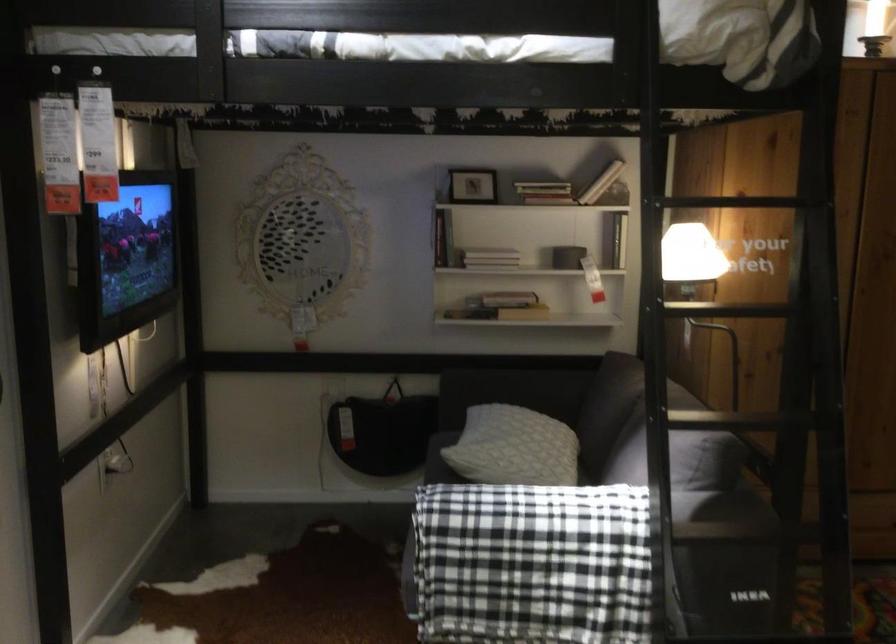
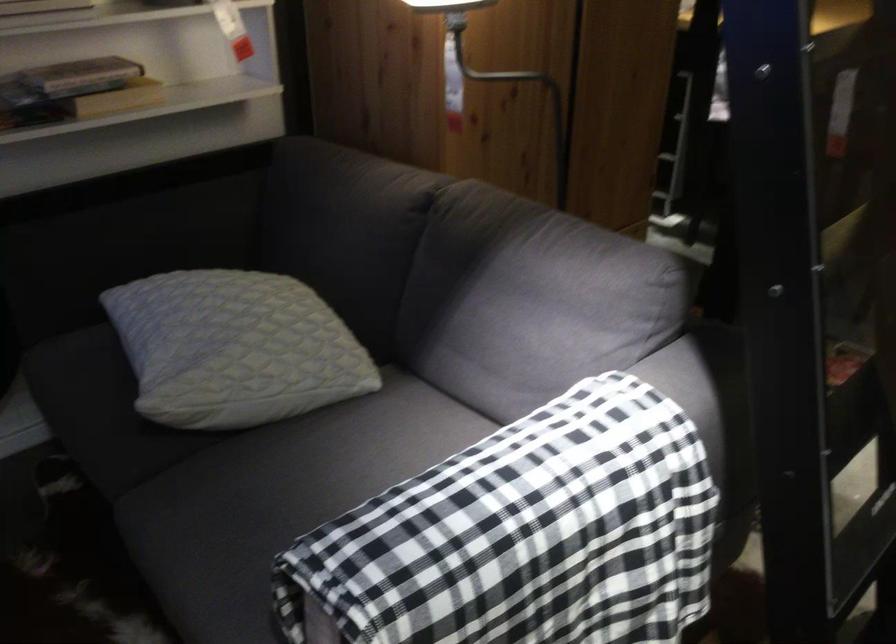
Locate, in the second image, the point that corresponds to (x=506, y=529) in the first image.

(522, 536)